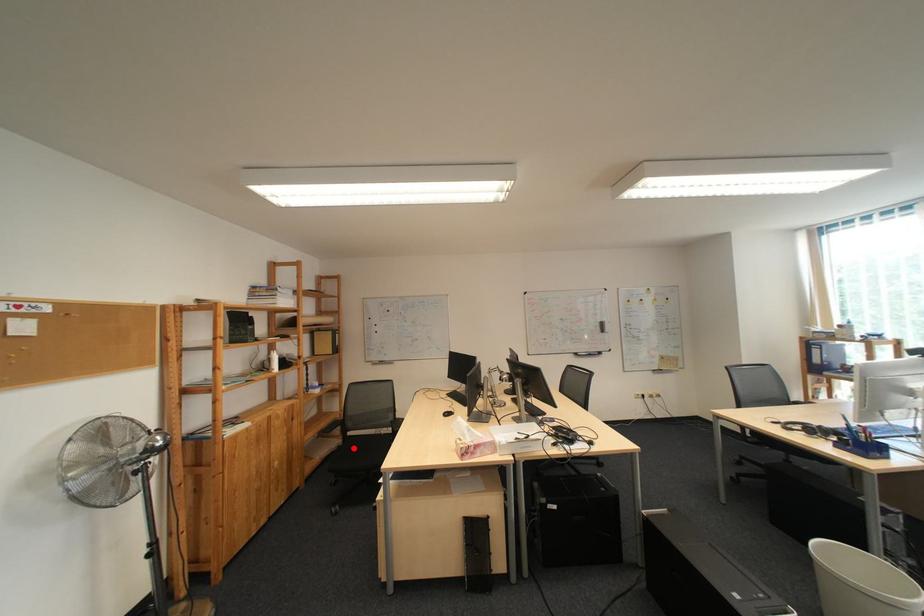
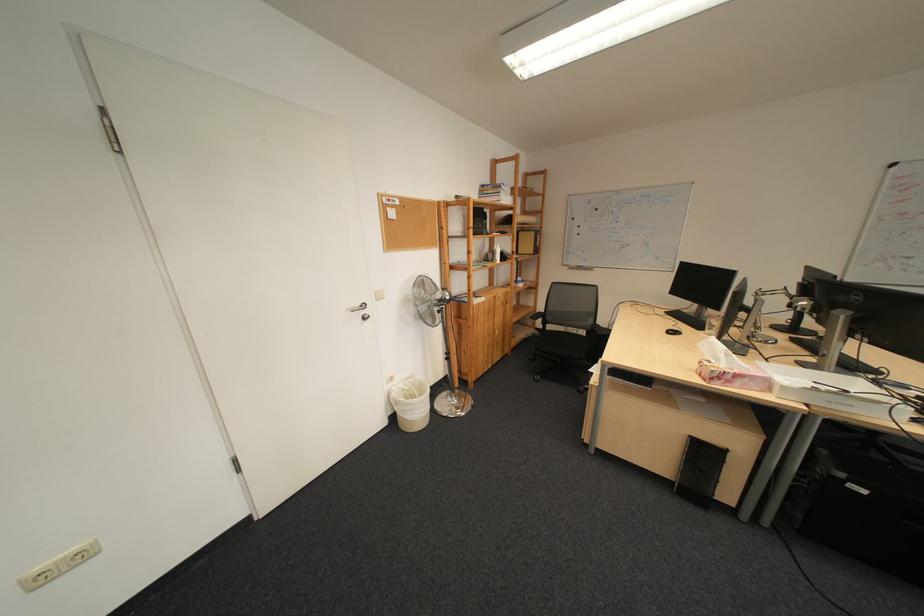
Question: A red point is marked in image1. In image2, is the corresponding 3D point closer to the camera or farther? Reply with the corresponding letter.

Choices:
 (A) The corresponding 3D point is closer.
 (B) The corresponding 3D point is farther.

Answer: (A)